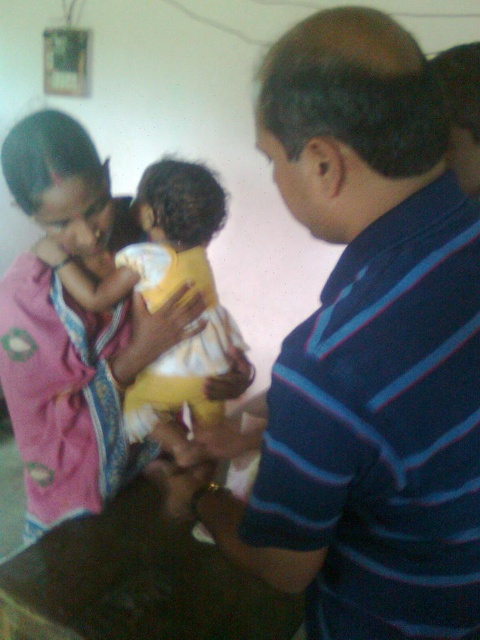
Consider the image. Is blue striped shirt at center closer to camera compared to yellow cotton baby at center?

Yes, blue striped shirt at center is in front of yellow cotton baby at center.

Between blue striped shirt at center and yellow cotton baby at center, which one appears on the right side from the viewer's perspective?

blue striped shirt at center

Which is behind, point (288, 209) or point (235, 336)?

Positioned behind is point (235, 336).

I want to click on blue striped shirt at center, so click(367, 349).